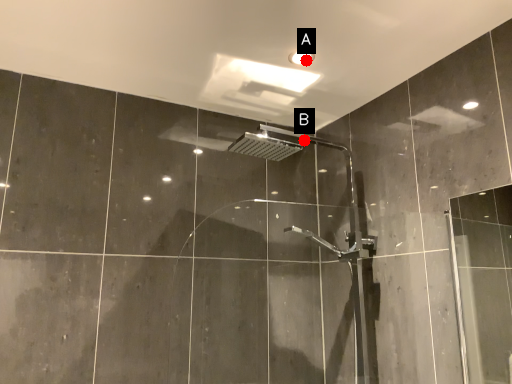
Question: Two points are circled on the image, labeled by A and B beside each circle. Which point appears farthest from the camera in this image?

Choices:
 (A) A is further
 (B) B is further

Answer: (B)